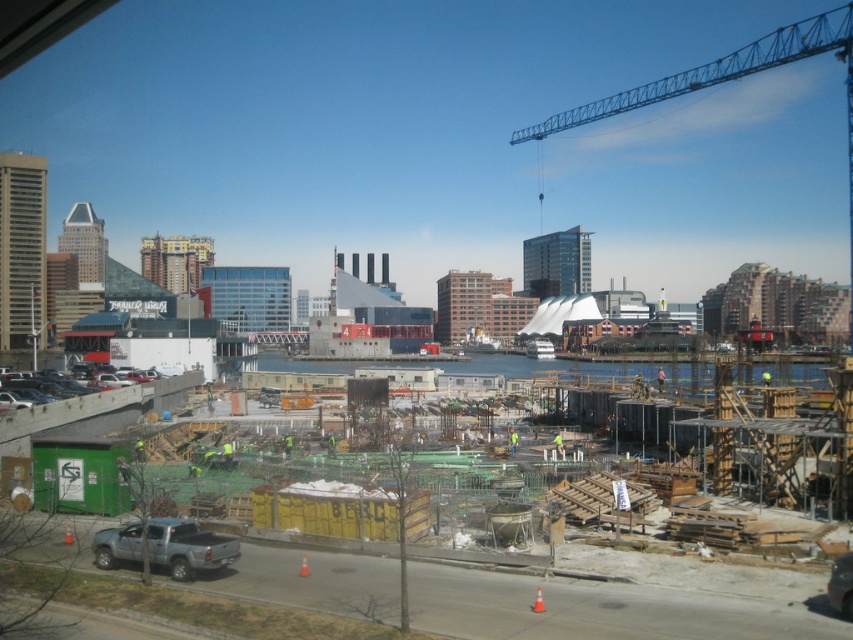
Which of these two, blue metallic crane at upper right or matte gray car at lower left, stands shorter?

matte gray car at lower left

Is point (776, 29) farther from viewer compared to point (71, 385)?

Yes, point (776, 29) is farther from viewer.

Who is more distant from viewer, (717, 72) or (36, 390)?

The point (717, 72) is behind.

Where is `blue metallic crane at upper right`? The width and height of the screenshot is (853, 640). blue metallic crane at upper right is located at coordinates (727, 80).

Is point (149, 561) farther from viewer compared to point (512, 452)?

No, it is not.

What do you see at coordinates (165, 547) in the screenshot? This screenshot has width=853, height=640. I see `silver metallic truck at lower left` at bounding box center [165, 547].

Locate an element on the screen. The height and width of the screenshot is (640, 853). silver metallic truck at lower left is located at coordinates (165, 547).

What do you see at coordinates (701, 580) in the screenshot? Image resolution: width=853 pixels, height=640 pixels. I see `yellowish-green wood at center` at bounding box center [701, 580].

Does yellowish-green wood at center have a greater width compared to blue metallic crane at upper right?

No, yellowish-green wood at center is not wider than blue metallic crane at upper right.

The width and height of the screenshot is (853, 640). I want to click on yellowish-green wood at center, so click(x=701, y=580).

Identify the location of yellowish-green wood at center. (701, 580).